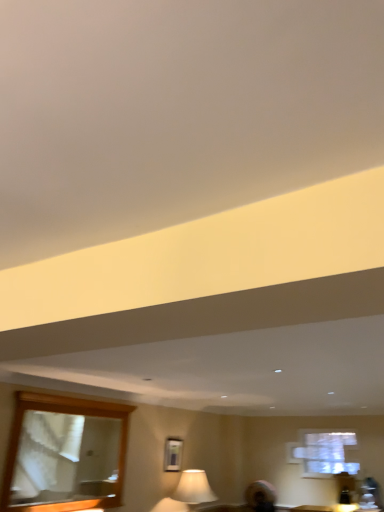
Question: Is wooden-framed mirror at lower left taller or shorter than metallic silver picture frame at center?

Choices:
 (A) short
 (B) tall

Answer: (B)

Question: From a real-world perspective, is wooden-framed mirror at lower left above or below metallic silver picture frame at center?

Choices:
 (A) below
 (B) above

Answer: (B)

Question: From the image's perspective, is wooden-framed mirror at lower left positioned above or below metallic silver picture frame at center?

Choices:
 (A) below
 (B) above

Answer: (B)

Question: Is metallic silver picture frame at center spatially inside wooden-framed mirror at lower left, or outside of it?

Choices:
 (A) outside
 (B) inside

Answer: (A)

Question: Considering the positions of point (168, 470) and point (39, 481), is point (168, 470) closer or farther from the camera than point (39, 481)?

Choices:
 (A) farther
 (B) closer

Answer: (A)

Question: Looking at their shapes, would you say metallic silver picture frame at center is wider or thinner than wooden-framed mirror at lower left?

Choices:
 (A) thin
 (B) wide

Answer: (A)

Question: Considering their positions, is metallic silver picture frame at center located in front of or behind wooden-framed mirror at lower left?

Choices:
 (A) behind
 (B) front

Answer: (A)